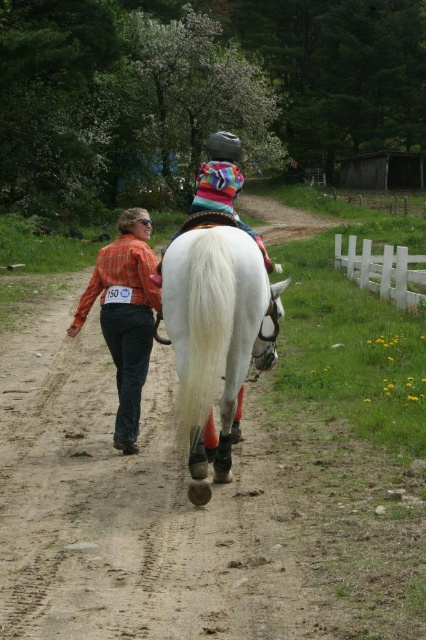
Question: Is white glossy horse at center closer to camera compared to orange plaid shirt at center?

Choices:
 (A) no
 (B) yes

Answer: (B)

Question: Is white glossy horse at center in front of orange plaid shirt at center?

Choices:
 (A) yes
 (B) no

Answer: (A)

Question: Which of the following is the farthest from the observer?

Choices:
 (A) orange plaid shirt at center
 (B) white glossy horse at center

Answer: (A)

Question: Can you confirm if white glossy horse at center is positioned above orange plaid shirt at center?

Choices:
 (A) no
 (B) yes

Answer: (B)